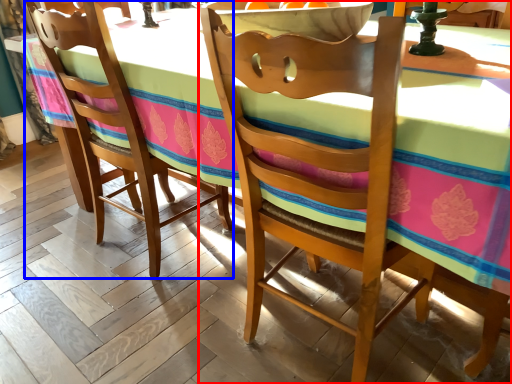
Question: Among these objects, which one is farthest to the camera, chair (highlighted by a red box) or chair (highlighted by a blue box)?

Choices:
 (A) chair
 (B) chair

Answer: (B)